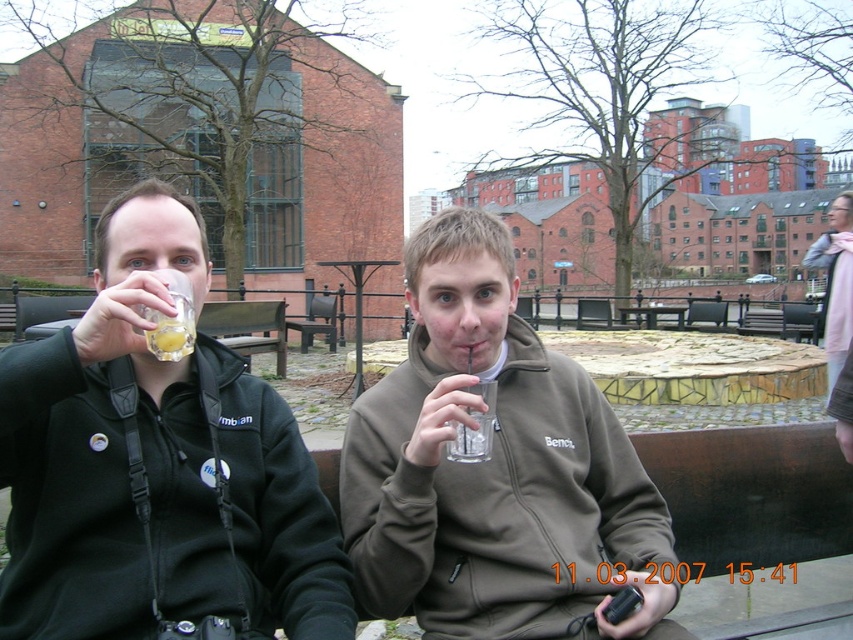
Question: Among these objects, which one is nearest to the camera?

Choices:
 (A) matte brown hoodie at center
 (B) matte black jacket at left
 (C) pink fabric scarf at upper right
 (D) translucent glass at upper left

Answer: (B)

Question: Can you confirm if matte brown hoodie at center is positioned above pink fabric scarf at upper right?

Choices:
 (A) yes
 (B) no

Answer: (B)

Question: Which of the following is the farthest from the observer?

Choices:
 (A) (155, 627)
 (B) (833, 330)
 (C) (376, 596)
 (D) (186, 301)

Answer: (B)

Question: Does matte black jacket at left lie in front of pink fabric scarf at upper right?

Choices:
 (A) yes
 (B) no

Answer: (A)

Question: Considering the real-world distances, which object is farthest from the matte brown hoodie at center?

Choices:
 (A) pink fabric scarf at upper right
 (B) matte black jacket at left
 (C) translucent glass at upper left

Answer: (A)

Question: Is matte brown hoodie at center behind pink fabric scarf at upper right?

Choices:
 (A) no
 (B) yes

Answer: (A)